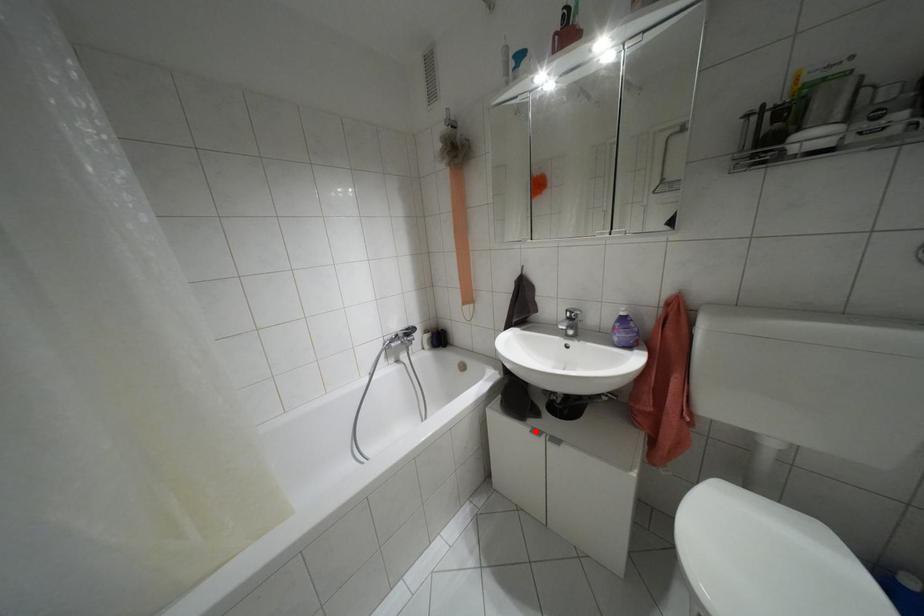
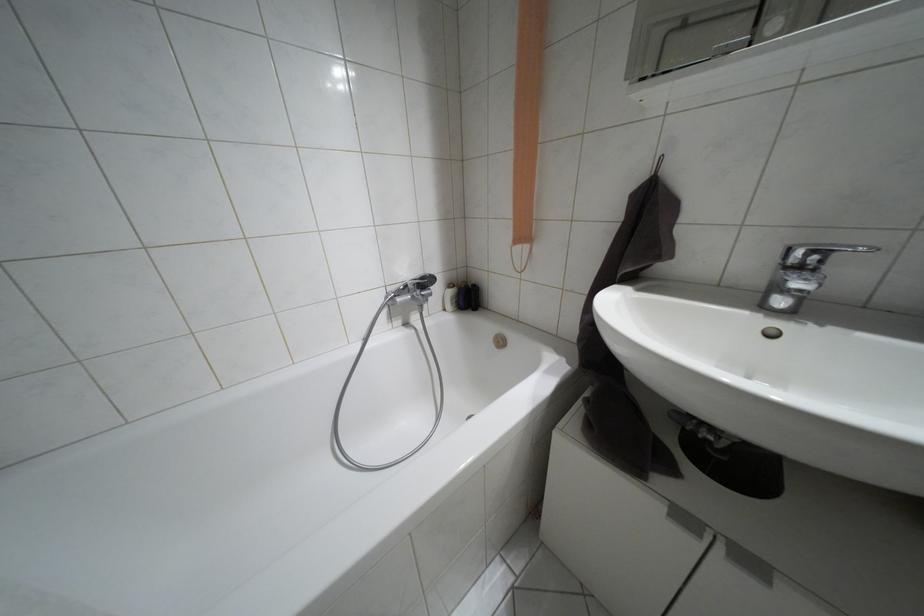
Find the pixel in the second image that matches the highlighted location in the first image.

(684, 517)